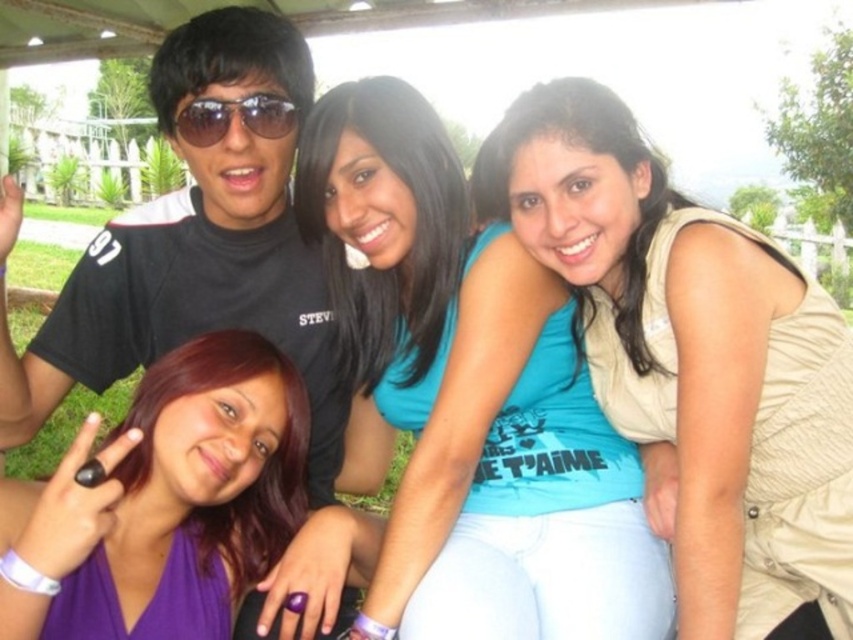
Question: Which point is closer to the camera?

Choices:
 (A) blue cotton shirt at center
 (B) blue fabric shirt at center
 (C) black matte shirt at upper left

Answer: (A)

Question: Among these points, which one is nearest to the camera?

Choices:
 (A) (364, 625)
 (B) (317, 490)
 (C) (567, 81)
 (D) (289, 113)

Answer: (A)

Question: Is blue fabric shirt at center to the left of purple fabric dress at lower left from the viewer's perspective?

Choices:
 (A) no
 (B) yes

Answer: (A)

Question: Where is black matte shirt at upper left located in relation to matte black sunglasses at upper center in the image?

Choices:
 (A) left
 (B) right

Answer: (A)

Question: Which point appears farthest from the camera in this image?

Choices:
 (A) (186, 118)
 (B) (711, 228)
 (C) (289, 461)

Answer: (A)

Question: Considering the relative positions of blue cotton shirt at center and blue fabric shirt at center in the image provided, where is blue cotton shirt at center located with respect to blue fabric shirt at center?

Choices:
 (A) left
 (B) right

Answer: (A)